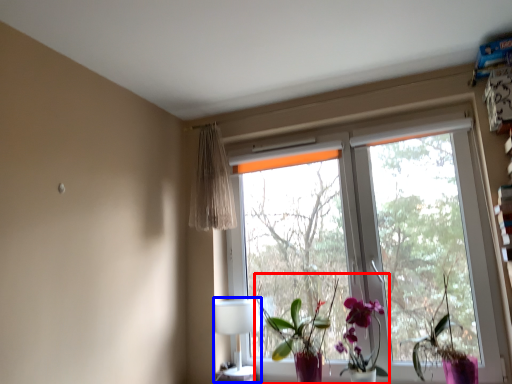
Question: Which object is closer to the camera taking this photo, floral arrangement (highlighted by a red box) or table lamp (highlighted by a blue box)?

Choices:
 (A) floral arrangement
 (B) table lamp

Answer: (A)